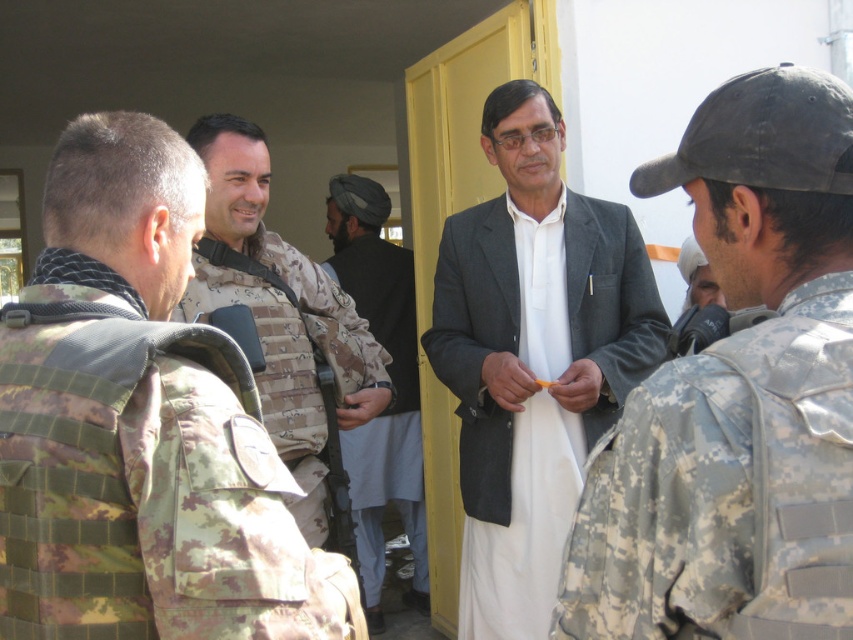
Can you confirm if white cotton shirt at center is positioned above camouflage fabric vest at center?

No.

Is white cotton shirt at center further to camera compared to camouflage fabric vest at center?

Yes, white cotton shirt at center is behind camouflage fabric vest at center.

Does point (479, 589) lie in front of point (352, 362)?

No, it is behind (352, 362).

At what (x,y) coordinates should I click in order to perform the action: click on white cotton shirt at center. Please return your answer as a coordinate pair (x, y). This screenshot has height=640, width=853. Looking at the image, I should click on [534, 381].

Can you confirm if camouflage fabric vest at left is smaller than dark brown woolen turban at center?

Yes, camouflage fabric vest at left is smaller than dark brown woolen turban at center.

Which is more to the left, camouflage fabric vest at left or dark brown woolen turban at center?

From the viewer's perspective, camouflage fabric vest at left appears more on the left side.

This screenshot has height=640, width=853. I want to click on camouflage fabric vest at left, so click(x=141, y=477).

Can you confirm if camouflage fabric vest at left is positioned below white cotton shirt at center?

→ Actually, camouflage fabric vest at left is above white cotton shirt at center.

Does camouflage fabric vest at left have a greater width compared to white cotton shirt at center?

No, camouflage fabric vest at left is not wider than white cotton shirt at center.

Is point (106, 508) positioned before point (534, 460)?

Yes, it is in front of point (534, 460).

Locate an element on the screen. camouflage fabric vest at left is located at coordinates pyautogui.click(x=141, y=477).